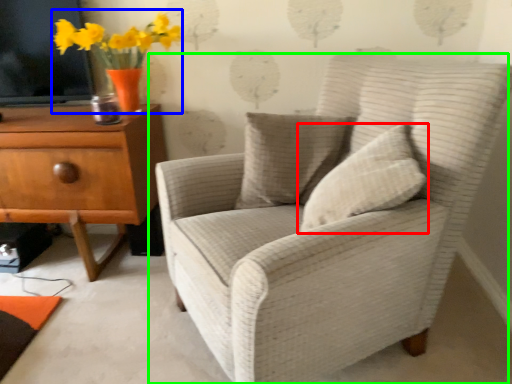
Question: Estimate the real-world distances between objects in this image. Which object is farther from pillow (highlighted by a red box), floral arrangement (highlighted by a blue box) or chair (highlighted by a green box)?

Choices:
 (A) floral arrangement
 (B) chair

Answer: (A)